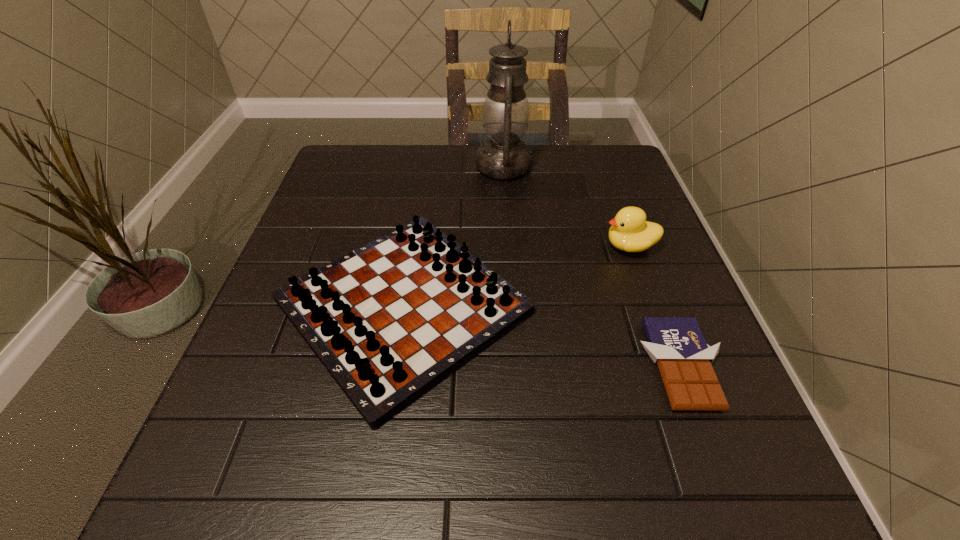
Find the location of a particular element. This screenshot has height=540, width=960. free location located on the back of the shortest object is located at coordinates (624, 215).

The image size is (960, 540). In order to click on object that is at the far edge in this screenshot , I will do (505, 115).

Locate an element on the screen. This screenshot has width=960, height=540. object that is at the left edge is located at coordinates click(390, 320).

Find the location of a particular element. duckling present at the right edge is located at coordinates coord(630,231).

Where is `chocolate bar present at the right edge`? The image size is (960, 540). chocolate bar present at the right edge is located at coordinates [x=676, y=344].

Image resolution: width=960 pixels, height=540 pixels. Find the location of `free spot at the far edge of the desktop`. free spot at the far edge of the desktop is located at coordinates (395, 171).

What are the coordinates of `blank area at the near edge` in the screenshot? It's located at (636, 505).

In the image, there is a desktop. At what (x,y) coordinates should I click in order to perform the action: click on vacant space at the left edge. Please return your answer as a coordinate pair (x, y). The height and width of the screenshot is (540, 960). Looking at the image, I should click on (256, 449).

This screenshot has height=540, width=960. Find the location of `vacant point at the right edge`. vacant point at the right edge is located at coordinates (703, 440).

What are the coordinates of `free region at the far right corner of the desktop` in the screenshot? It's located at (620, 190).